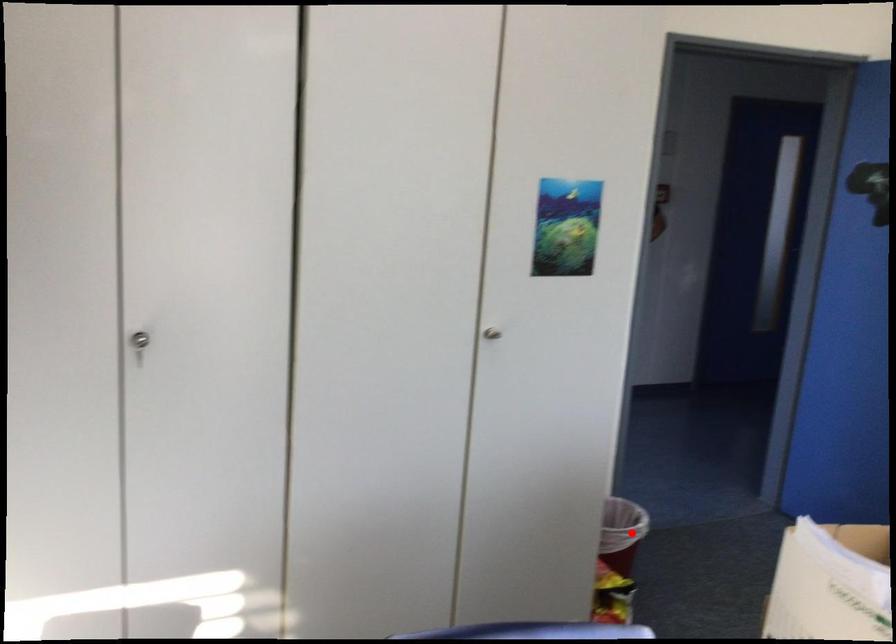
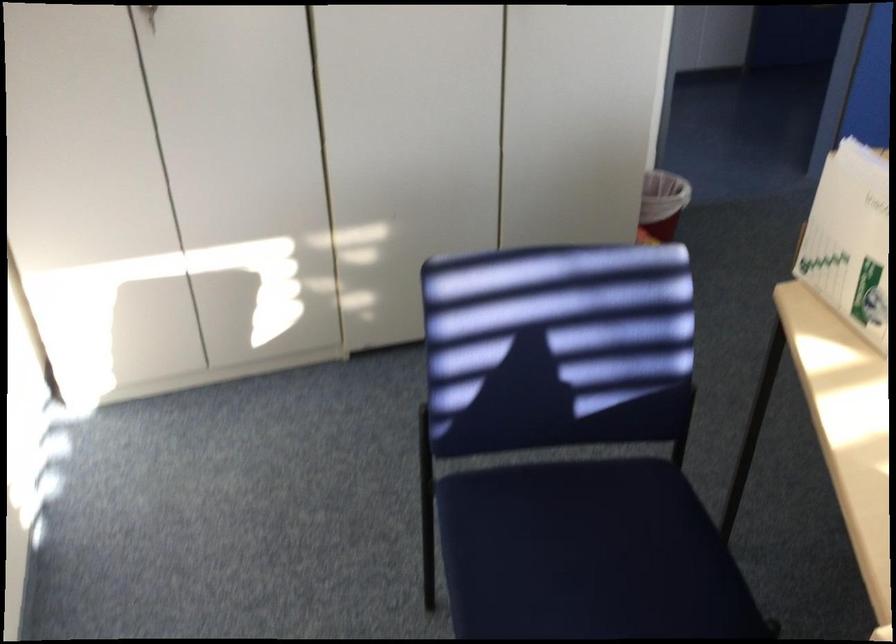
Find the pixel in the second image that matches the highlighted location in the first image.

(661, 203)